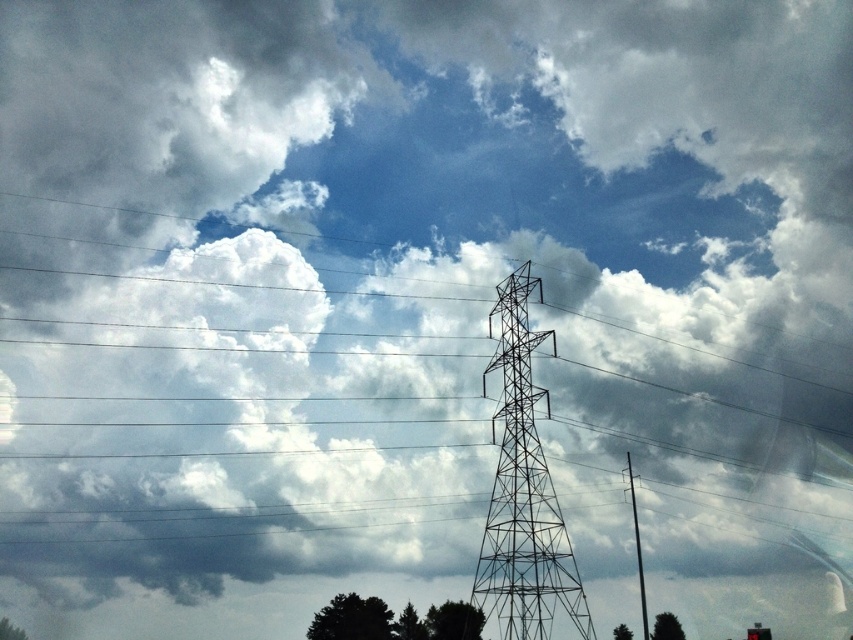
Which is above, metallic wire tower at center or metallic gray pole at center-right?

metallic wire tower at center is above.

Is point (521, 403) closer to viewer compared to point (645, 625)?

No, it is behind (645, 625).

Which is in front, point (532, 422) or point (639, 540)?

Positioned in front is point (639, 540).

Image resolution: width=853 pixels, height=640 pixels. What are the coordinates of `metallic wire tower at center` in the screenshot? It's located at (523, 492).